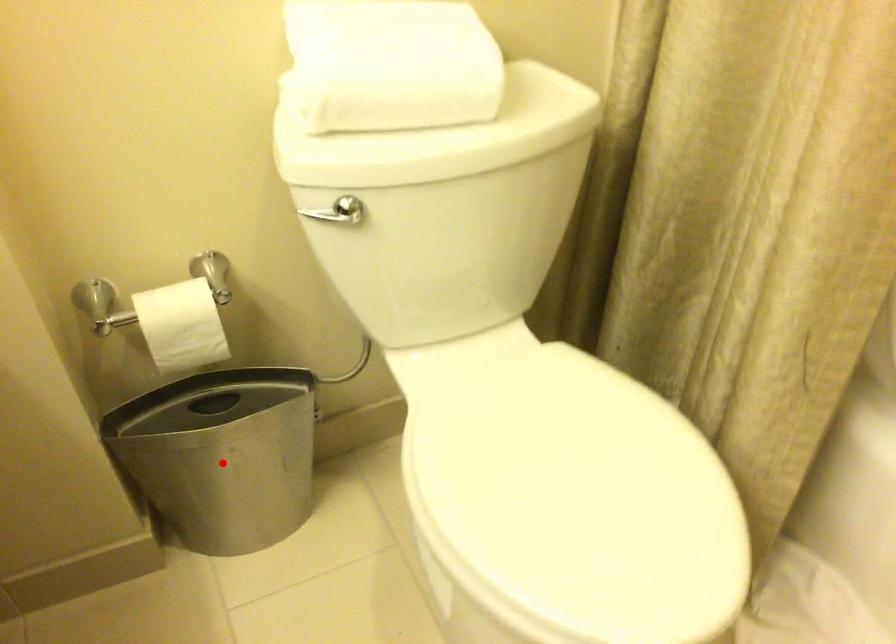
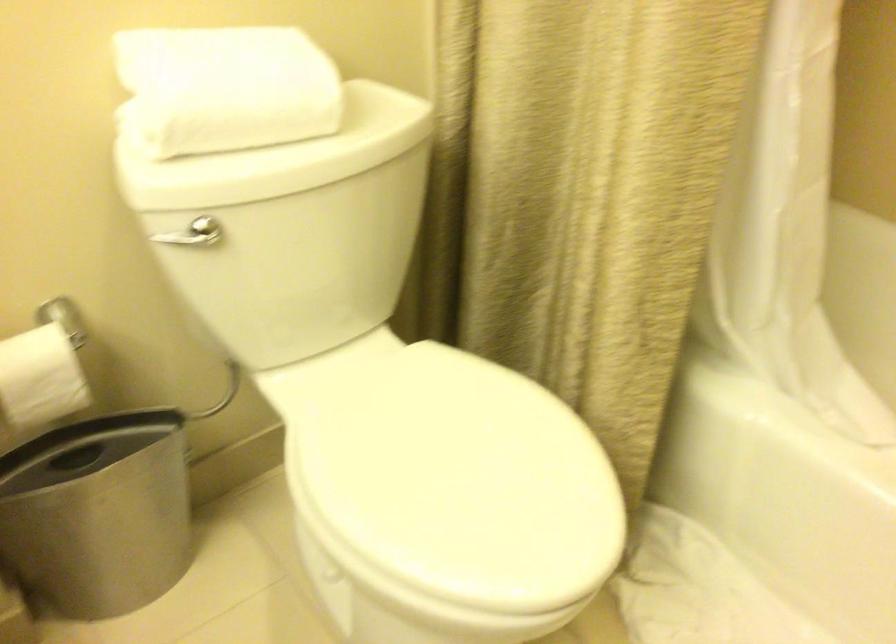
Locate, in the second image, the point that corresponds to the highlighted location in the first image.

(98, 514)